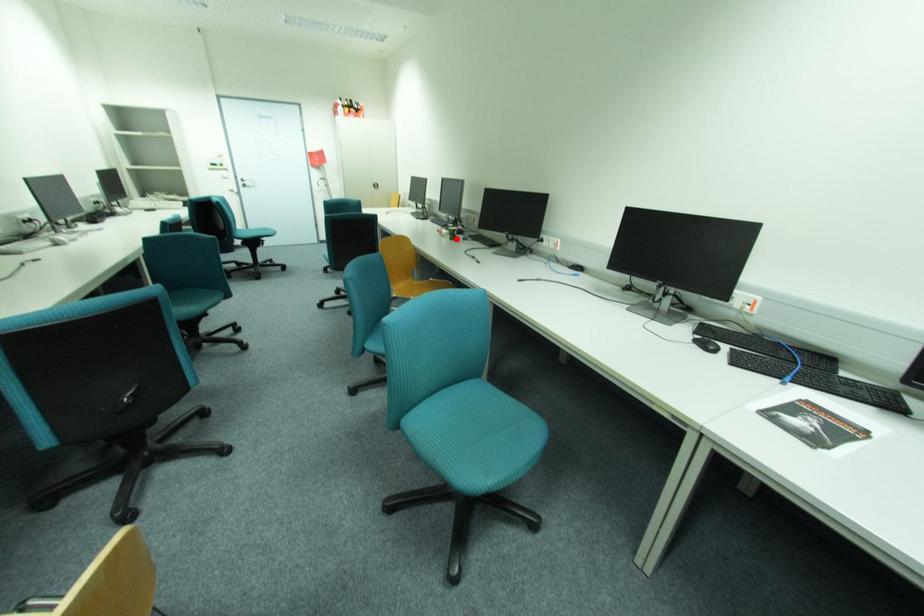
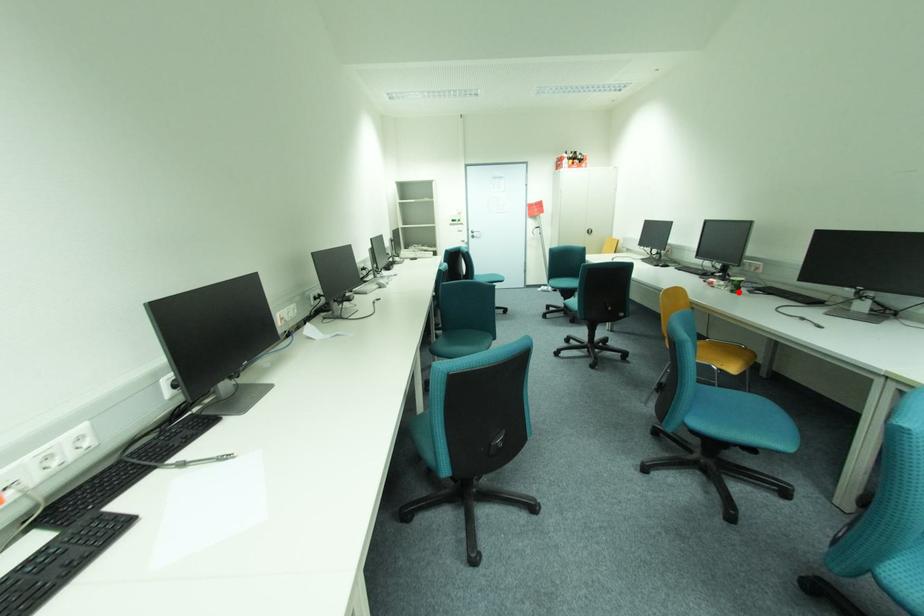
I am providing you with two images of the same scene from different viewpoints. A red point is marked on the first image and another point is marked on the second image. Does the point marked in image1 correspond to the same location as the one in image2?

Yes